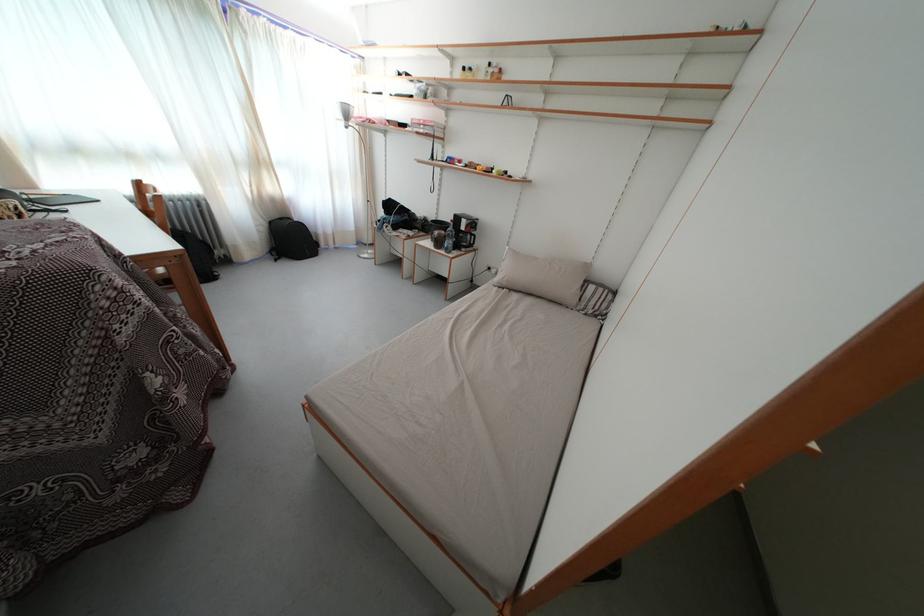
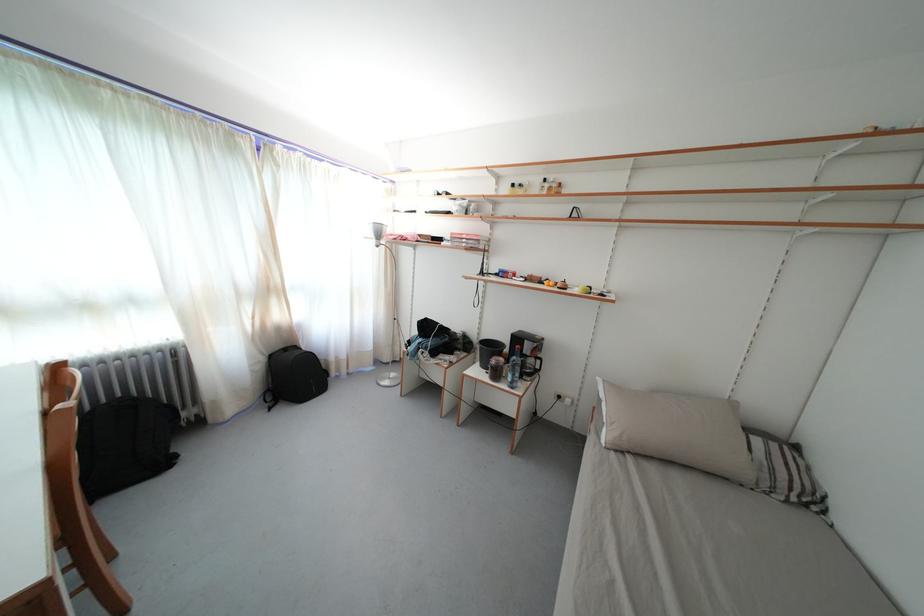
The point at (464,225) is marked in the first image. Where is the corresponding point in the second image?

(524, 345)